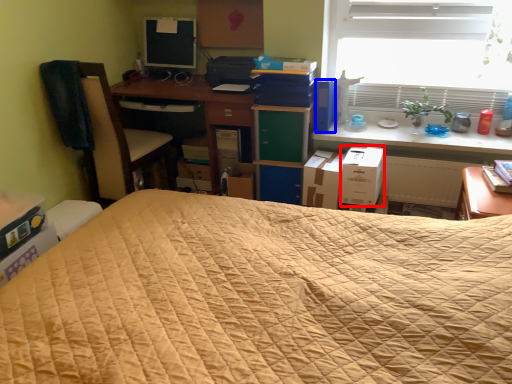
Question: Which of the following is the closest to the observer, cardboard box (highlighted by a red box) or paperback book (highlighted by a blue box)?

Choices:
 (A) cardboard box
 (B) paperback book

Answer: (A)